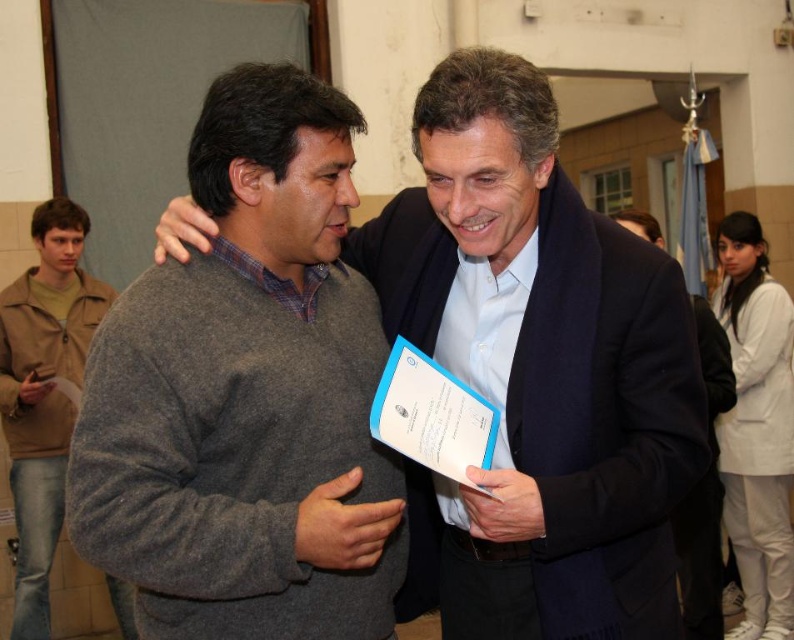
Consider the image. Who is more distant from viewer, (205, 160) or (505, 152)?

The point (205, 160) is more distant.

Identify the location of gray wool sweater at left. The width and height of the screenshot is (794, 640). (247, 394).

The width and height of the screenshot is (794, 640). Find the location of `gray wool sweater at left`. gray wool sweater at left is located at coordinates (247, 394).

This screenshot has width=794, height=640. I want to click on gray wool sweater at left, so click(247, 394).

Can you confirm if gray wool sweater at center is thinner than brown leather jacket at left?

Incorrect, gray wool sweater at center's width is not less than brown leather jacket at left's.

Is gray wool sweater at center above brown leather jacket at left?

Yes.

Does point (500, 461) lie in front of point (45, 256)?

Yes.

Find the location of a particular element. gray wool sweater at center is located at coordinates (538, 372).

Who is more forward, [149,301] or [91,321]?

Point [149,301]

Which is in front, point (79, 508) or point (58, 307)?

Positioned in front is point (79, 508).

Image resolution: width=794 pixels, height=640 pixels. Identify the location of gray wool sweater at left. (247, 394).